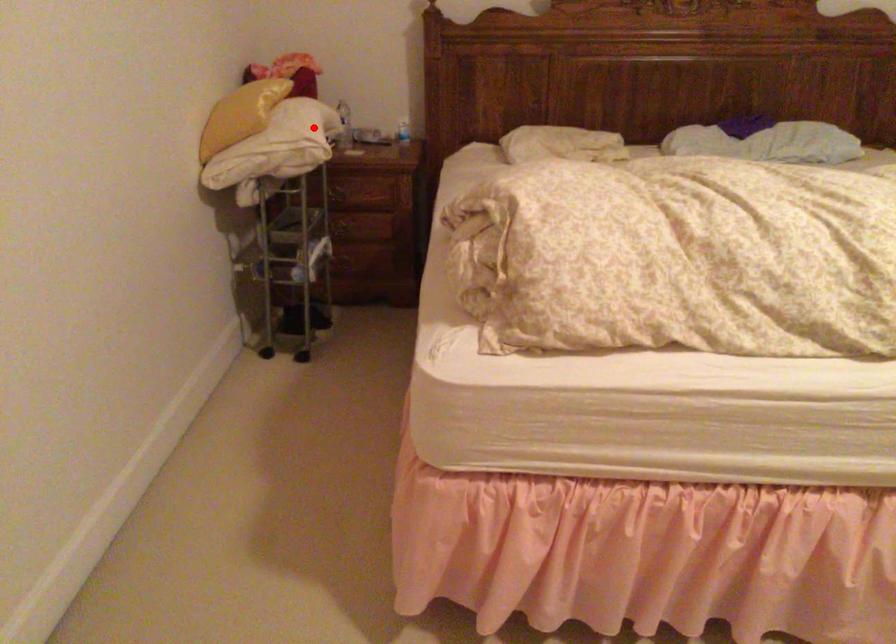
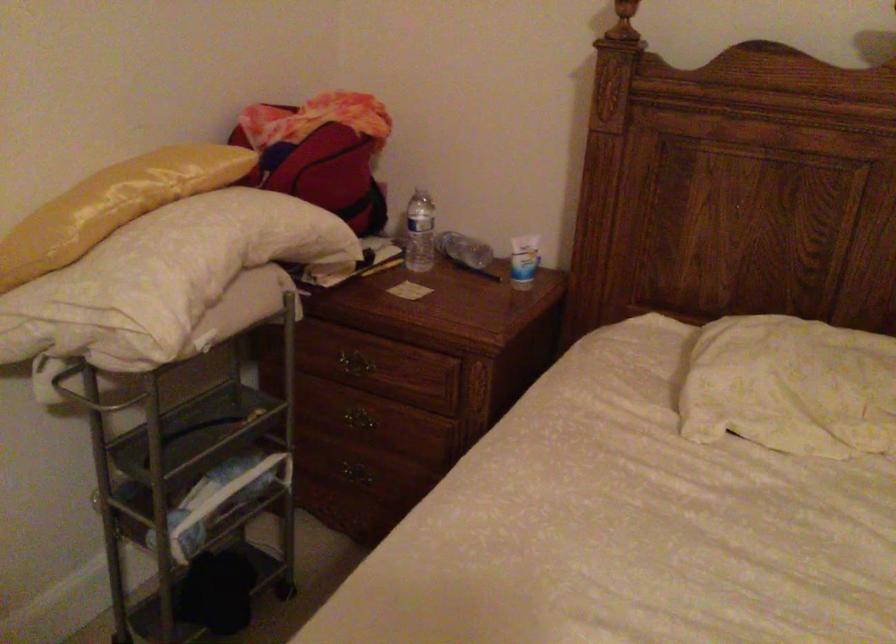
Question: A red point is marked in image1. In image2, is the corresponding 3D point closer to the camera or farther? Reply with the corresponding letter.

Choices:
 (A) The corresponding 3D point is closer.
 (B) The corresponding 3D point is farther.

Answer: (A)